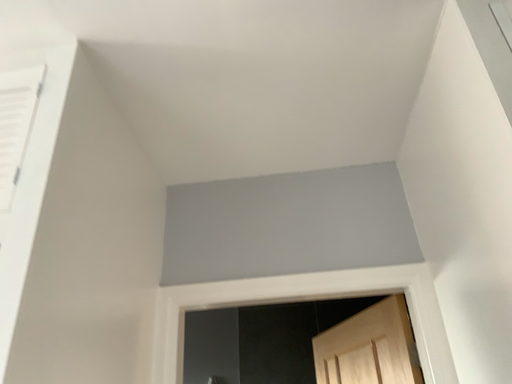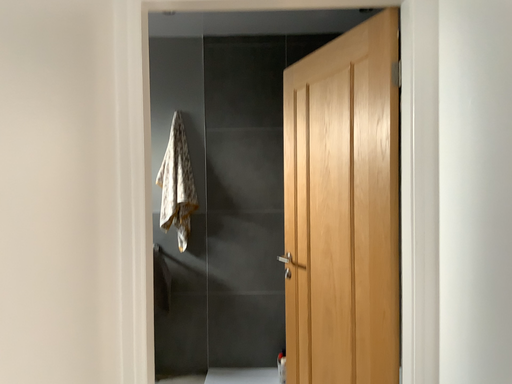
Question: Which way did the camera rotate in the video?

Choices:
 (A) rotated downward
 (B) rotated upward

Answer: (A)